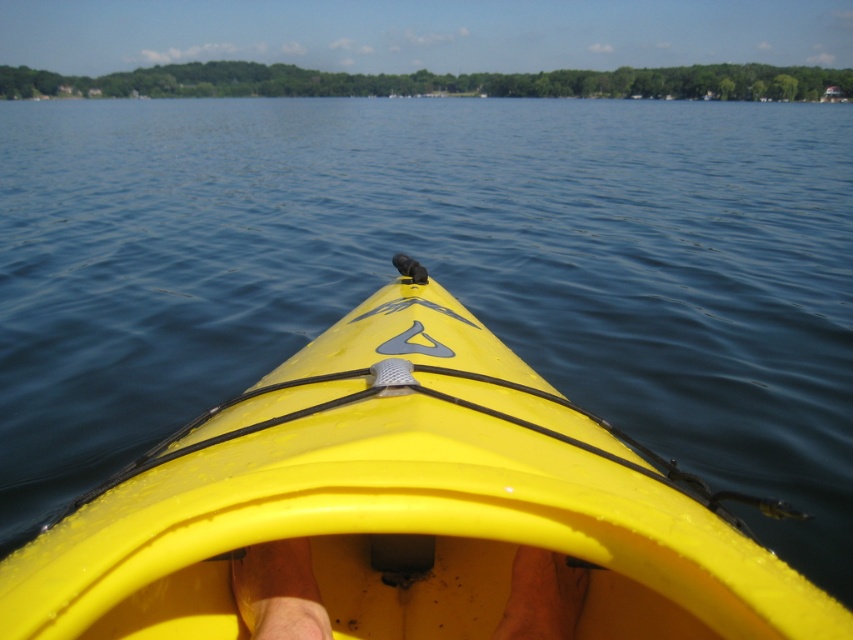
Question: Which object appears closest to the camera in this image?

Choices:
 (A) skinny yellow kayak at center
 (B) yellow plastic kayak at center

Answer: (B)

Question: Does yellow plastic kayak at center lie in front of skinny yellow kayak at center?

Choices:
 (A) no
 (B) yes

Answer: (B)

Question: Is yellow plastic kayak at center positioned in front of skinny yellow kayak at center?

Choices:
 (A) yes
 (B) no

Answer: (A)

Question: Observing the image, what is the correct spatial positioning of yellow plastic kayak at center in reference to skinny yellow kayak at center?

Choices:
 (A) above
 (B) below

Answer: (A)